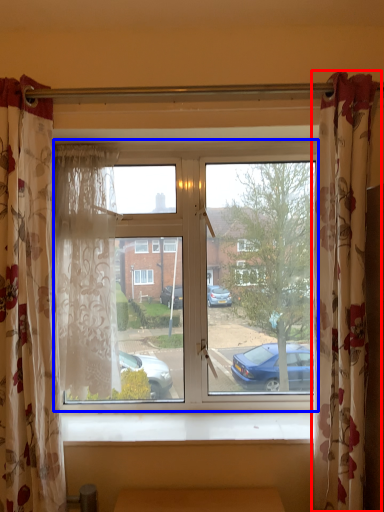
Question: Which object is further to the camera taking this photo, curtain (highlighted by a red box) or window (highlighted by a blue box)?

Choices:
 (A) curtain
 (B) window

Answer: (B)